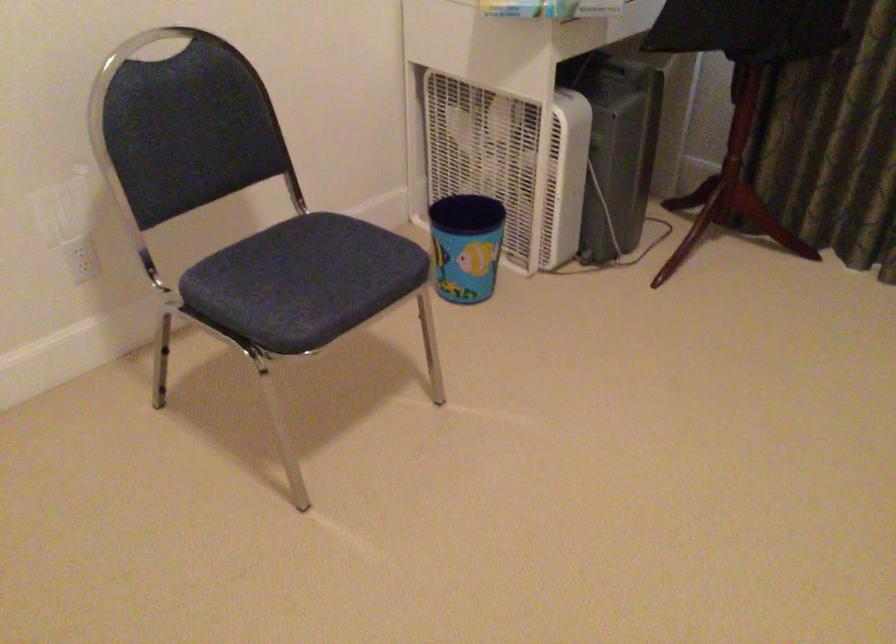
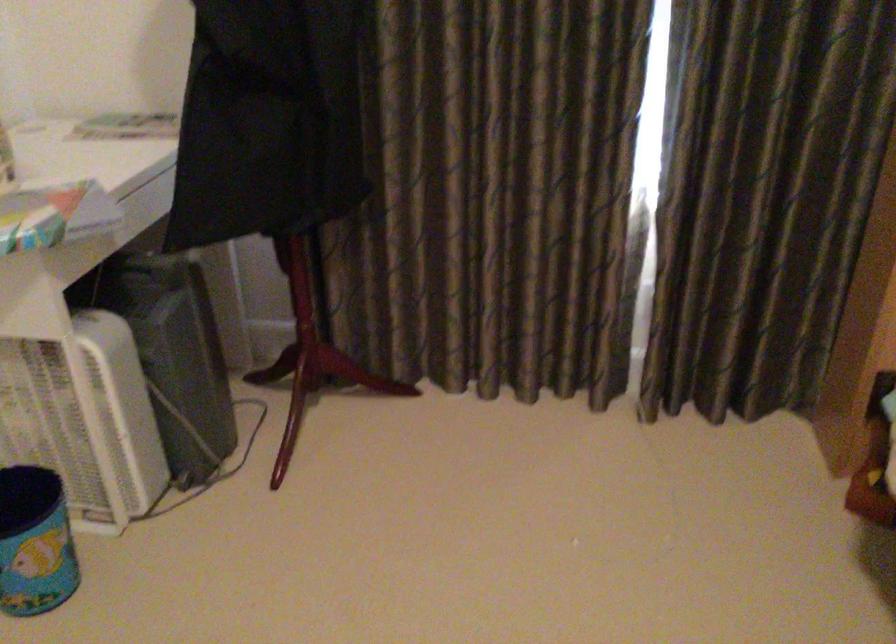
Question: The camera is either moving clockwise (left) or counter-clockwise (right) around the object. The first image is from the beginning of the video and the second image is from the end. Is the camera moving left or right when shooting the video?

Choices:
 (A) Left
 (B) Right

Answer: (A)